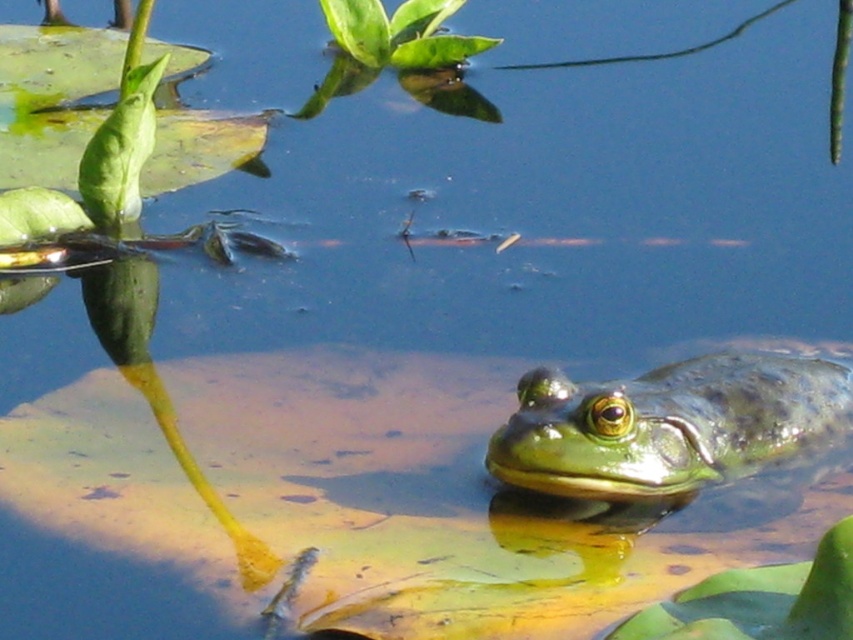
Question: Is green rough skin frog at lower right in front of green leafy plant at upper center?

Choices:
 (A) yes
 (B) no

Answer: (A)

Question: Among these points, which one is farthest from the camera?

Choices:
 (A) (440, 0)
 (B) (751, 467)

Answer: (A)

Question: Can you confirm if green rough skin frog at lower right is positioned to the left of green leafy plant at upper center?

Choices:
 (A) no
 (B) yes

Answer: (A)

Question: Is green rough skin frog at lower right to the right of green leafy plant at upper center from the viewer's perspective?

Choices:
 (A) yes
 (B) no

Answer: (A)